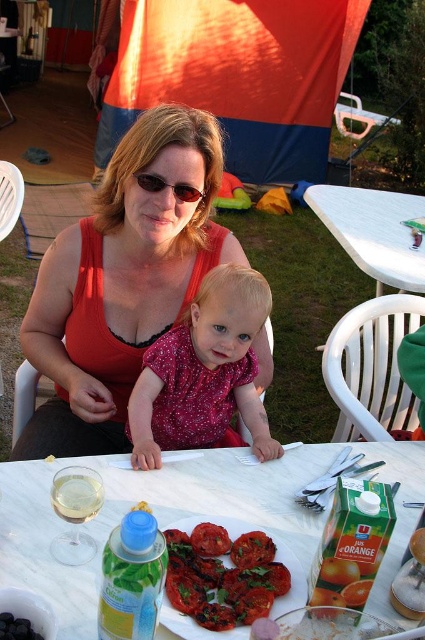
You are standing at the entrance of the backyard and want to place a new potted plant on the white marble table at center. Based on the coordinates provided, can you determine the exact position where the table is located?

The white marble table at center is located at point (153, 512), so the potted plant should be placed there.

You are setting up a small decorative item that is 20 cm in width. You have to place it on the white marble table at center. Considering the tomato at center is already there, will the space on the table be sufficient?

The white marble table at center might be wider than tomato at center, so there is a possibility that the space on the table is sufficient for placing the 20 cm decorative item, but it depends on the exact dimensions of both objects.

You are planning to place a large salad bowl on the table. Given the current items on the white marble table at center and the tomato at center, is there enough space?

The white marble table at center has a larger size compared to tomato at center, so there should be enough space to place the large salad bowl on the table.